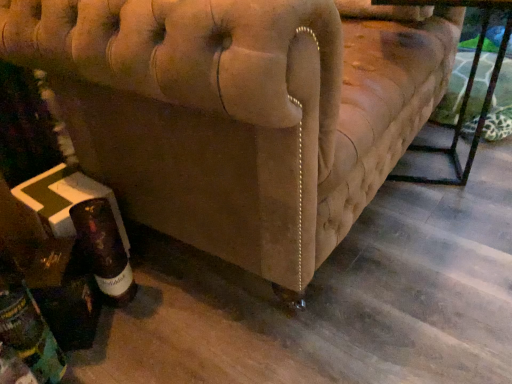
Locate an element on the screen. This screenshot has height=384, width=512. free space in front of metallic black table at lower right is located at coordinates (434, 210).